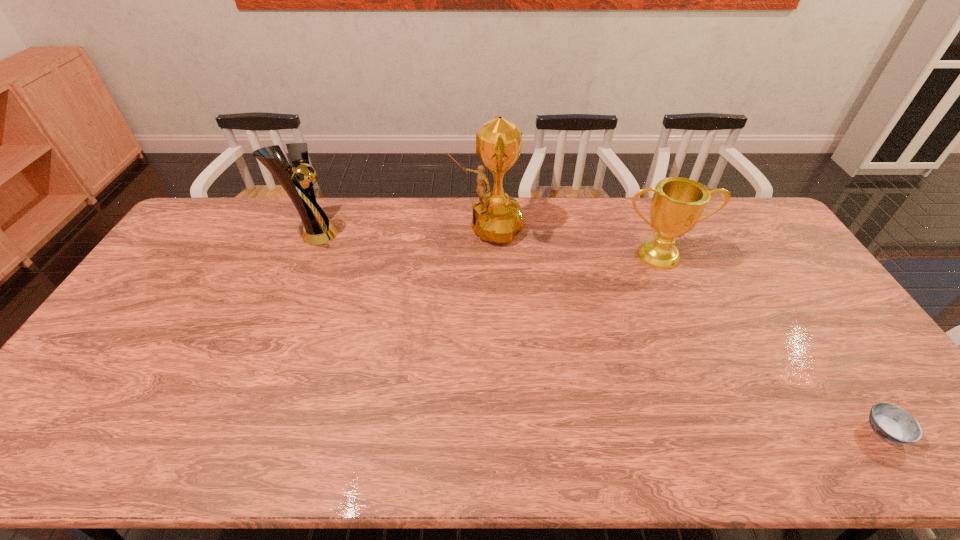
The width and height of the screenshot is (960, 540). Find the location of `the second object from left to right`. the second object from left to right is located at coordinates (496, 217).

The width and height of the screenshot is (960, 540). In order to click on the leftmost award in this screenshot , I will do `click(318, 229)`.

You are a GUI agent. You are given a task and a screenshot of the screen. Output one action in this format:
    pyautogui.click(x=<x>, y=<y>)
    Task: Click on the third tallest object
    
    Given the screenshot: What is the action you would take?
    pyautogui.click(x=677, y=204)

Find the location of a particular element. the rightmost award is located at coordinates (677, 204).

At what (x,y) coordinates should I click in order to perform the action: click on the nearest object. Please return your answer as a coordinate pair (x, y). Looking at the image, I should click on (892, 423).

What are the coordinates of `the shortest object` in the screenshot? It's located at (892, 423).

Identify the location of vacant space located on the front side of the second award from left to right. (421, 226).

This screenshot has width=960, height=540. In order to click on vacant space located 0.080m on the front side of the second award from left to right in this screenshot , I will do `click(427, 226)`.

Locate an element on the screen. This screenshot has height=540, width=960. vacant space located on the front side of the second award from left to right is located at coordinates (396, 226).

At what (x,y) coordinates should I click in order to perform the action: click on free space located 0.160m at the front of the leftmost award, where the globe is visible. Please return your answer as a coordinate pair (x, y). Image resolution: width=960 pixels, height=540 pixels. Looking at the image, I should click on (384, 233).